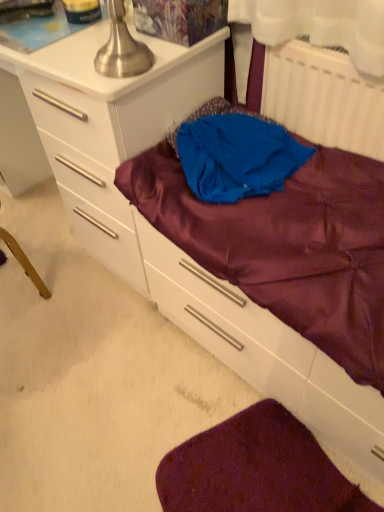
I want to click on vacant space situated above purple satin sheet at lower right (from a real-world perspective), so click(257, 478).